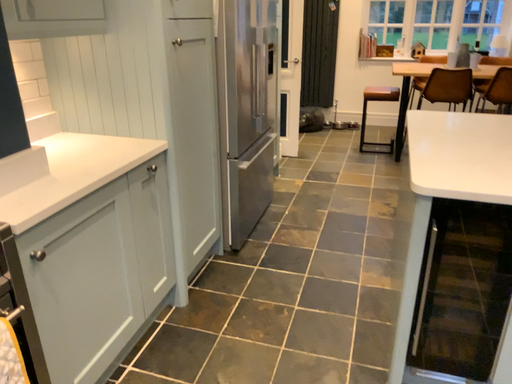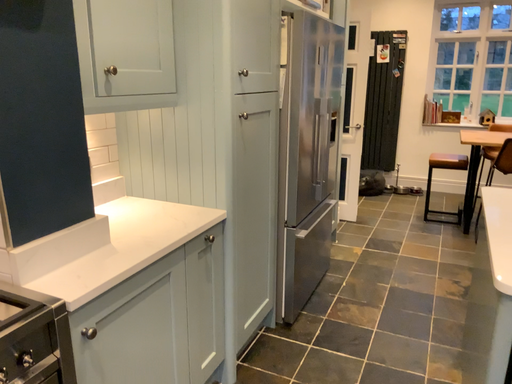
Question: How did the camera likely rotate when shooting the video?

Choices:
 (A) rotated downward
 (B) rotated upward

Answer: (B)